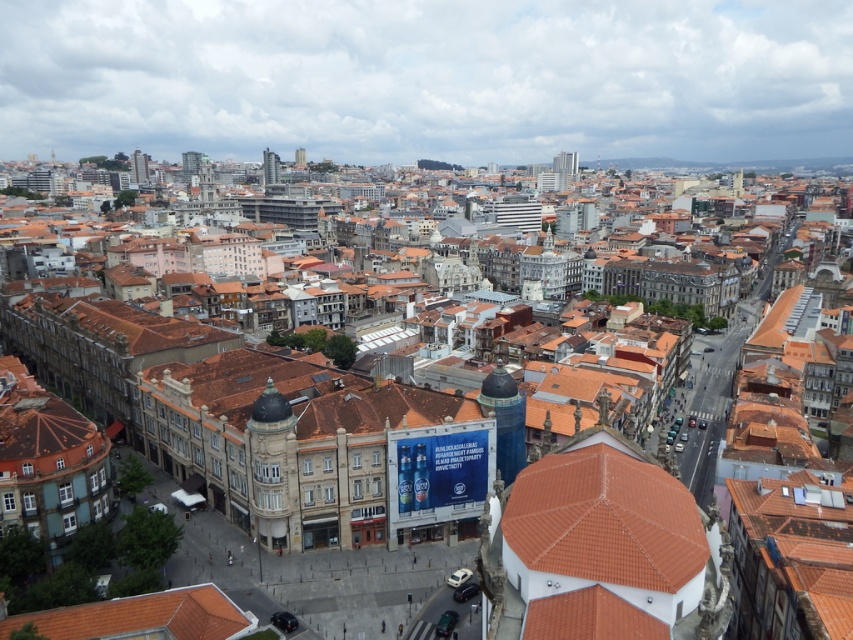
Question: Which point appears farthest from the camera in this image?

Choices:
 (A) (650, 588)
 (B) (148, 166)
 (C) (280, 538)

Answer: (B)

Question: Among these objects, which one is nearest to the camera?

Choices:
 (A) blue glass tower at center
 (B) metallic glass tower at upper left

Answer: (A)

Question: In this image, where is gold textured dome at center located relative to metallic glass tower at upper center?

Choices:
 (A) left
 (B) right

Answer: (B)

Question: Estimate the real-world distances between objects in this image. Which object is farther from the metallic glass tower at upper left?

Choices:
 (A) smooth gray tower at center
 (B) gold textured dome at center

Answer: (B)

Question: Does terracotta tiled dome at center lie behind blue glass tower at center?

Choices:
 (A) yes
 (B) no

Answer: (B)

Question: Can you confirm if metallic glass tower at upper center is positioned to the left of metallic glass tower at upper left?

Choices:
 (A) no
 (B) yes

Answer: (A)